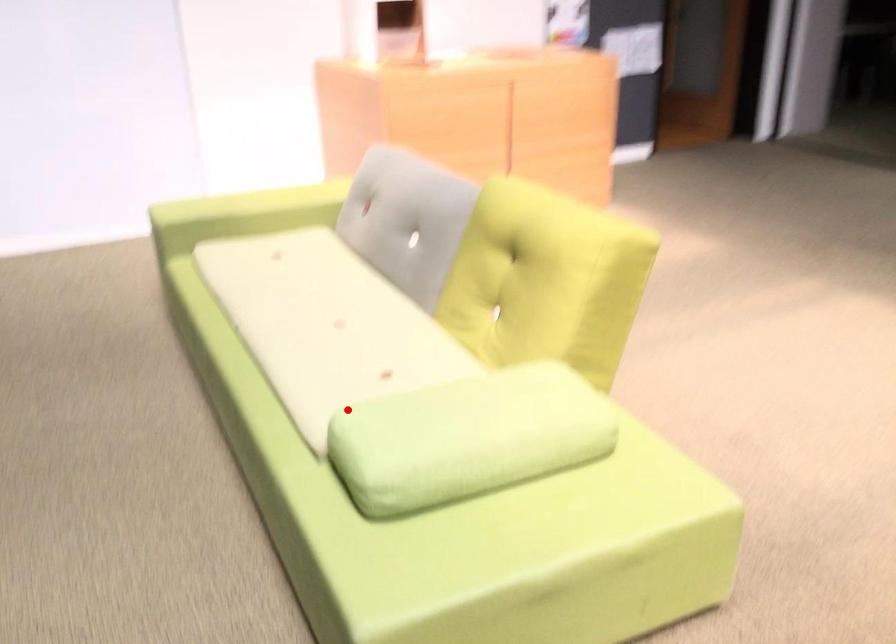
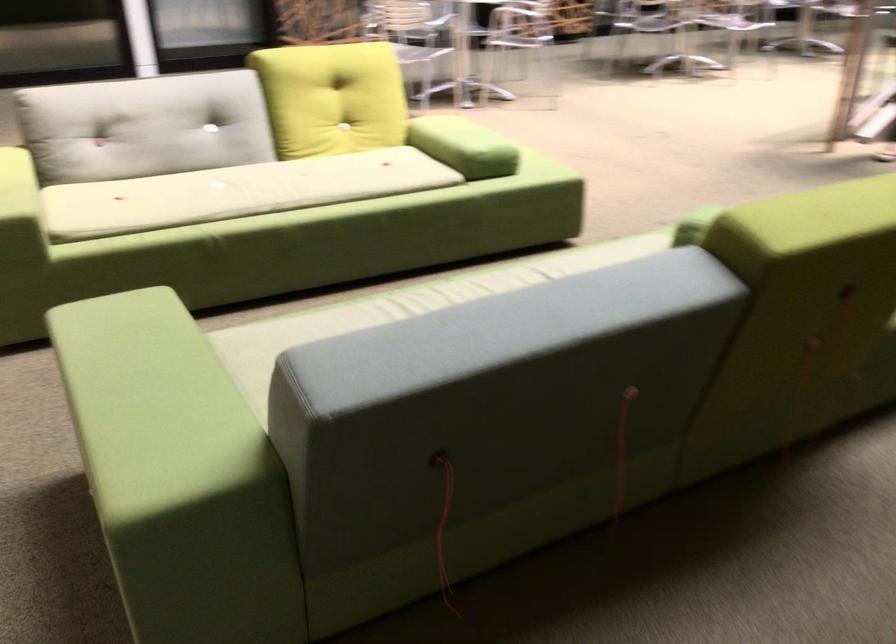
Question: I am providing you with two images of the same scene from different viewpoints. A red point is shown in image1. For the corresponding object point in image2, is it positioned nearer or farther from the camera?

Choices:
 (A) Nearer
 (B) Farther

Answer: (B)